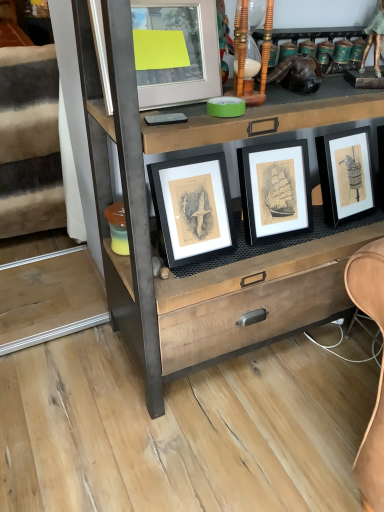
Question: Does matte glass picture frame at upper center have a larger size compared to white fabric at left?

Choices:
 (A) yes
 (B) no

Answer: (B)

Question: From the image's perspective, is matte glass picture frame at upper center beneath white fabric at left?

Choices:
 (A) yes
 (B) no

Answer: (A)

Question: Is matte glass picture frame at upper center oriented towards white fabric at left?

Choices:
 (A) no
 (B) yes

Answer: (A)

Question: Is matte glass picture frame at upper center smaller than white fabric at left?

Choices:
 (A) yes
 (B) no

Answer: (A)

Question: Considering the relative positions of matte glass picture frame at upper center and white fabric at left in the image provided, is matte glass picture frame at upper center to the left of white fabric at left from the viewer's perspective?

Choices:
 (A) yes
 (B) no

Answer: (B)

Question: Considering the positions of point pos(41,113) and point pos(127,276), is point pos(41,113) closer or farther from the camera than point pos(127,276)?

Choices:
 (A) farther
 (B) closer

Answer: (A)

Question: From a real-world perspective, is white fabric at left above or below wooden chest of drawers at center?

Choices:
 (A) above
 (B) below

Answer: (B)

Question: In terms of width, does white fabric at left look wider or thinner when compared to wooden chest of drawers at center?

Choices:
 (A) wide
 (B) thin

Answer: (A)

Question: Is white fabric at left bigger or smaller than wooden chest of drawers at center?

Choices:
 (A) big
 (B) small

Answer: (B)

Question: Looking at the image, does wooden chest of drawers at center seem bigger or smaller compared to matte glass picture frame at upper center?

Choices:
 (A) big
 (B) small

Answer: (A)

Question: In terms of width, does wooden chest of drawers at center look wider or thinner when compared to matte glass picture frame at upper center?

Choices:
 (A) thin
 (B) wide

Answer: (B)

Question: Considering the relative positions of wooden chest of drawers at center and matte glass picture frame at upper center in the image provided, is wooden chest of drawers at center to the left or to the right of matte glass picture frame at upper center?

Choices:
 (A) right
 (B) left

Answer: (A)

Question: Choose the correct answer: Is wooden chest of drawers at center inside matte glass picture frame at upper center or outside it?

Choices:
 (A) outside
 (B) inside

Answer: (A)

Question: Which is correct: matte glass picture frame at upper center is inside wooden chest of drawers at center, or outside of it?

Choices:
 (A) outside
 (B) inside

Answer: (B)

Question: Is point (150, 5) closer or farther from the camera than point (114, 260)?

Choices:
 (A) farther
 (B) closer

Answer: (B)